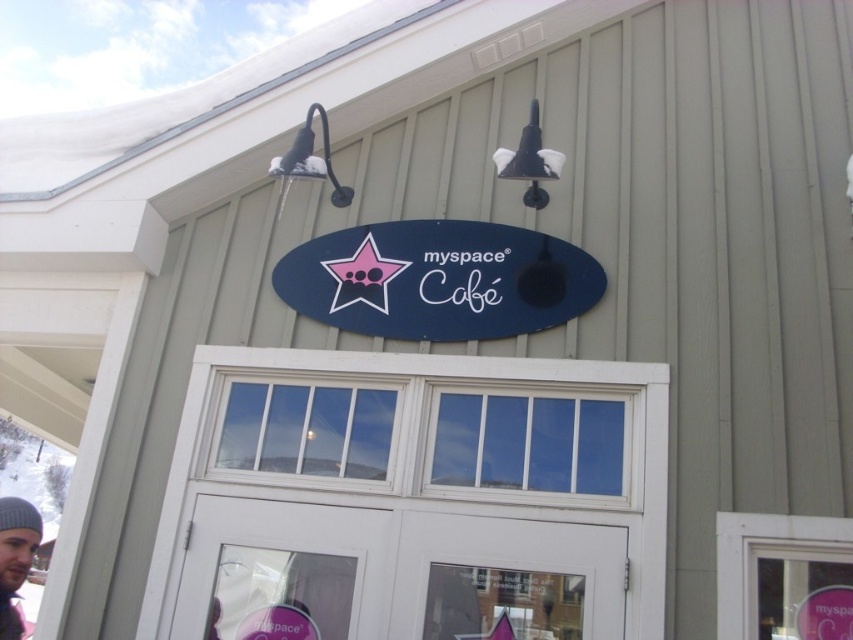
Question: Which point appears closest to the camera in this image?

Choices:
 (A) (647, 433)
 (B) (602, 291)
 (C) (7, 556)

Answer: (C)

Question: Which object is farther from the camera taking this photo?

Choices:
 (A) white wooden door at center
 (B) gray knit beanie at lower left

Answer: (A)

Question: Can you confirm if white wooden door at center is positioned above matte blue sign at center?

Choices:
 (A) no
 (B) yes

Answer: (A)

Question: In this image, where is matte blue sign at center located relative to gray knit beanie at lower left?

Choices:
 (A) above
 (B) below

Answer: (A)

Question: Does matte blue sign at center come behind gray knit beanie at lower left?

Choices:
 (A) no
 (B) yes

Answer: (B)

Question: Which point is farther to the camera?

Choices:
 (A) gray knit beanie at lower left
 (B) white wooden door at center

Answer: (B)